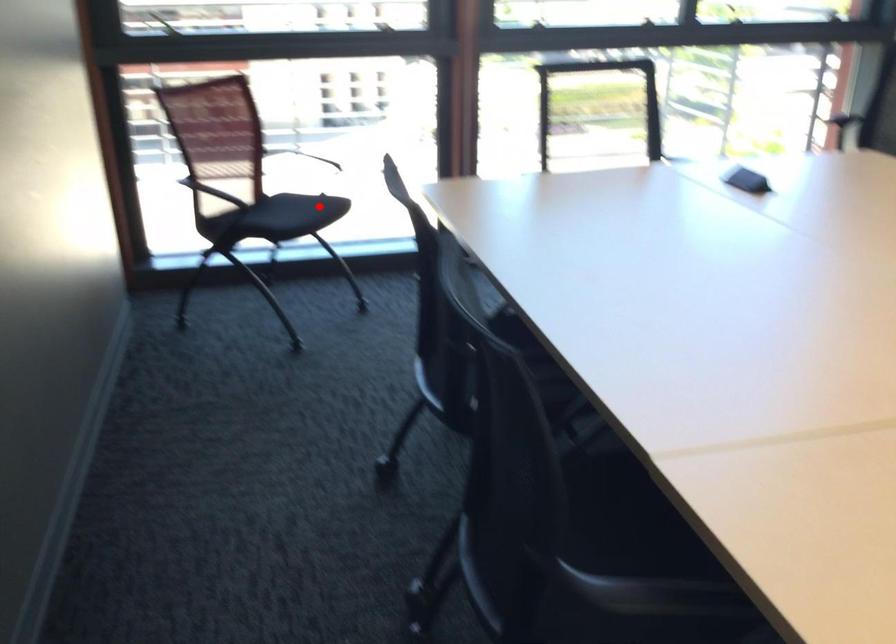
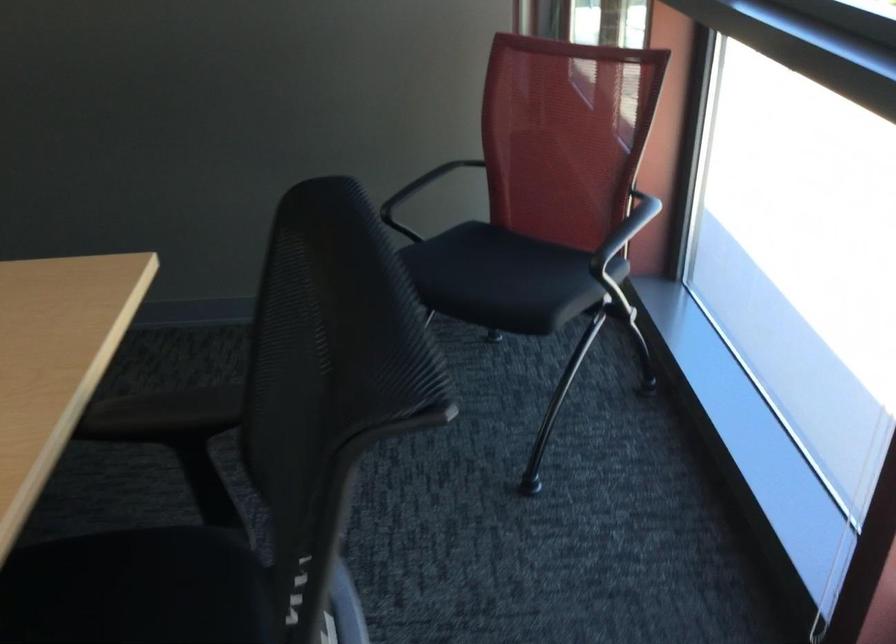
Question: I am providing you with two images of the same scene from different viewpoints. In image1, a red point is highlighted. Considering the same 3D point in image2, which of the following is correct?

Choices:
 (A) It is closer
 (B) It is farther

Answer: (A)